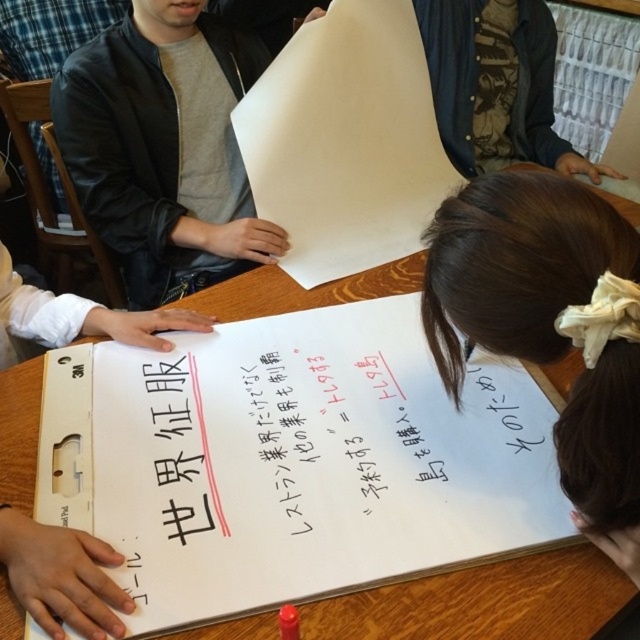
Between point (440, 269) and point (317, 205), which one is positioned in front?

Positioned in front is point (440, 269).

Is white paper at lower right closer to the viewer compared to white paper at center?

Yes, white paper at lower right is closer to the viewer.

Where is `white paper at lower right`? white paper at lower right is located at coordinates (518, 266).

Between matte black jacket at upper left and white paper at center, which one has more height?

Standing taller between the two is white paper at center.

Looking at this image, does matte black jacket at upper left appear on the left side of white paper at center?

Indeed, matte black jacket at upper left is positioned on the left side of white paper at center.

Is point (72, 76) positioned behind point (314, 24)?

That is False.

Where is `matte black jacket at upper left`? This screenshot has width=640, height=640. matte black jacket at upper left is located at coordinates (163, 147).

Between white paper at center and white paperboard at center, which one appears on the right side from the viewer's perspective?

From the viewer's perspective, white paper at center appears more on the right side.

Is white paper at center further to the viewer compared to white paperboard at center?

Yes, white paper at center is behind white paperboard at center.

Is point (289, 166) positioned before point (88, 554)?

No, it is behind (88, 554).

You are a GUI agent. You are given a task and a screenshot of the screen. Output one action in this format:
    pyautogui.click(x=<x>, y=<y>)
    Task: Click on the white paper at center
    
    Given the screenshot: What is the action you would take?
    pyautogui.click(x=346, y=141)